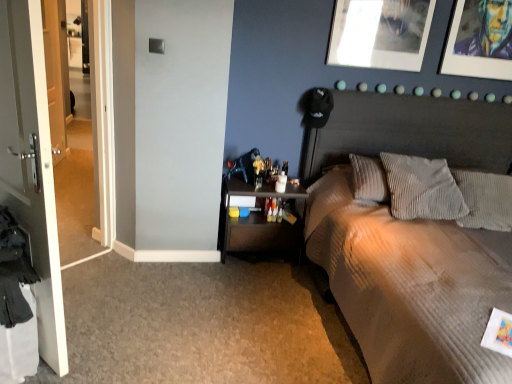
The image size is (512, 384). Describe the element at coordinates (31, 164) in the screenshot. I see `white glossy door at left` at that location.

Describe the element at coordinates (380, 33) in the screenshot. I see `metallic silver picture frame at upper center, which appears as the first picture frame when viewed from the left` at that location.

The image size is (512, 384). What are the coordinates of `white corduroy pillow at center, which is the 1th pillow from left to right` in the screenshot? It's located at (422, 188).

The width and height of the screenshot is (512, 384). Find the location of `gray corduroy pillow at right, the 1th pillow from the right`. gray corduroy pillow at right, the 1th pillow from the right is located at coordinates (485, 200).

Considering the sizes of objects dark wood nightstand at lower center and white corduroy pillow at center, the 2th pillow when ordered from right to left, in the image provided, who is smaller, dark wood nightstand at lower center or white corduroy pillow at center, the 2th pillow when ordered from right to left,?

white corduroy pillow at center, the 2th pillow when ordered from right to left.

Is dark wood nightstand at lower center facing towards white corduroy pillow at center, the 2th pillow when ordered from right to left?

No, dark wood nightstand at lower center does not turn towards white corduroy pillow at center, the 2th pillow when ordered from right to left.

In order to click on nightstand located below the white corduroy pillow at center, the 2th pillow when ordered from right to left (from the image's perspective) in this screenshot , I will do coord(258,221).

From a real-world perspective, is white corduroy pillow at center, which is the 1th pillow from left to right, positioned above or below textured beige bed at upper right?

Clearly, from a real-world perspective, white corduroy pillow at center, which is the 1th pillow from left to right, is above textured beige bed at upper right.

Consider the image. Which object is positioned more to the left, white corduroy pillow at center, the 2th pillow when ordered from right to left, or textured beige bed at upper right?

From the viewer's perspective, white corduroy pillow at center, the 2th pillow when ordered from right to left, appears more on the left side.

Considering their positions, is white corduroy pillow at center, the 2th pillow when ordered from right to left, located in front of or behind textured beige bed at upper right?

In the image, white corduroy pillow at center, the 2th pillow when ordered from right to left, appears behind textured beige bed at upper right.

Can we say textured beige bed at upper right lies outside metallic silver picture frame at upper right, which is the 1th picture frame in right-to-left order?

textured beige bed at upper right is positioned outside metallic silver picture frame at upper right, which is the 1th picture frame in right-to-left order.

Which of these two, textured beige bed at upper right or metallic silver picture frame at upper right, which is the second picture frame in left-to-right order, is bigger?

textured beige bed at upper right is bigger.

Is textured beige bed at upper right to the left of metallic silver picture frame at upper right, which is the 1th picture frame in right-to-left order, from the viewer's perspective?

Correct, you'll find textured beige bed at upper right to the left of metallic silver picture frame at upper right, which is the 1th picture frame in right-to-left order.

From a real-world perspective, is textured beige bed at upper right beneath metallic silver picture frame at upper right, which is the 1th picture frame in right-to-left order?

Yes, from a real-world perspective, textured beige bed at upper right is under metallic silver picture frame at upper right, which is the 1th picture frame in right-to-left order.

The image size is (512, 384). Find the location of `door above the gray corduroy pillow at right, acting as the second pillow starting from the left (from a real-world perspective)`. door above the gray corduroy pillow at right, acting as the second pillow starting from the left (from a real-world perspective) is located at coordinates (31, 164).

Between point (455, 179) and point (47, 235), which one is positioned behind?

The point (455, 179) is farther from the camera.

Relative to white glossy door at left, is gray corduroy pillow at right, the 1th pillow from the right, in front or behind?

gray corduroy pillow at right, the 1th pillow from the right, is positioned farther from the viewer than white glossy door at left.

Between gray corduroy pillow at right, the 1th pillow from the right, and white glossy door at left, which one appears on the left side from the viewer's perspective?

Positioned to the left is white glossy door at left.

Could you measure the distance between textured beige bed at upper right and gray corduroy pillow at right, acting as the second pillow starting from the left?

textured beige bed at upper right and gray corduroy pillow at right, acting as the second pillow starting from the left, are 19.31 inches apart.

Can gray corduroy pillow at right, acting as the second pillow starting from the left, be found inside textured beige bed at upper right?

Yes, gray corduroy pillow at right, acting as the second pillow starting from the left, is a part of textured beige bed at upper right.

Based on the photo, from a real-world perspective, is textured beige bed at upper right positioned over gray corduroy pillow at right, the 1th pillow from the right, based on gravity?

No, from a real-world perspective, textured beige bed at upper right is not above gray corduroy pillow at right, the 1th pillow from the right.

In the image, there is a gray corduroy pillow at right, acting as the second pillow starting from the left. At what (x,y) coordinates should I click in order to perform the action: click on bed below it (from the image's perspective). Please return your answer as a coordinate pair (x, y). This screenshot has width=512, height=384. Looking at the image, I should click on (411, 287).

Is metallic silver picture frame at upper center, acting as the second picture frame starting from the right, positioned behind white glossy door at left?

Yes.

Is metallic silver picture frame at upper center, acting as the second picture frame starting from the right, with white glossy door at left?

No, metallic silver picture frame at upper center, acting as the second picture frame starting from the right, is not making contact with white glossy door at left.

Is metallic silver picture frame at upper center, acting as the second picture frame starting from the right, wider than white glossy door at left?

Incorrect, the width of metallic silver picture frame at upper center, acting as the second picture frame starting from the right, does not surpass that of white glossy door at left.

Between gray corduroy pillow at right, the 1th pillow from the right, and white corduroy pillow at center, which is the 1th pillow from left to right, which one has larger width?

gray corduroy pillow at right, the 1th pillow from the right.

Is gray corduroy pillow at right, acting as the second pillow starting from the left, oriented towards white corduroy pillow at center, which is the 1th pillow from left to right?

No.

Considering the relative sizes of gray corduroy pillow at right, the 1th pillow from the right, and white corduroy pillow at center, which is the 1th pillow from left to right, in the image provided, is gray corduroy pillow at right, the 1th pillow from the right, bigger than white corduroy pillow at center, which is the 1th pillow from left to right,?

No, gray corduroy pillow at right, the 1th pillow from the right, is not bigger than white corduroy pillow at center, which is the 1th pillow from left to right.

From a real-world perspective, starting from the dark wood nightstand at lower center, which pillow is the 2nd one vertically above it? Please provide its 2D coordinates.

[(422, 188)]

Locate an element on the screen. The image size is (512, 384). bed below the white corduroy pillow at center, which is the 1th pillow from left to right (from the image's perspective) is located at coordinates (411, 287).

Based on their spatial positions, is white glossy door at left or gray corduroy pillow at right, the 1th pillow from the right, further from textured beige bed at upper right?

white glossy door at left lies further to textured beige bed at upper right than the other object.

Looking at the image, which one is located further to gray corduroy pillow at right, acting as the second pillow starting from the left, white glossy door at left or metallic silver picture frame at upper center, acting as the second picture frame starting from the right?

white glossy door at left is further to gray corduroy pillow at right, acting as the second pillow starting from the left.

Which object lies nearer to the anchor point dark wood nightstand at lower center, white corduroy pillow at center, which is the 1th pillow from left to right, or gray corduroy pillow at right, the 1th pillow from the right?

white corduroy pillow at center, which is the 1th pillow from left to right, is positioned closer to the anchor dark wood nightstand at lower center.

From the image, which object appears to be farther from dark wood nightstand at lower center, metallic silver picture frame at upper center, acting as the second picture frame starting from the right, or metallic silver picture frame at upper right, which is the second picture frame in left-to-right order?

metallic silver picture frame at upper right, which is the second picture frame in left-to-right order.

Looking at the image, which one is located further to gray corduroy pillow at right, acting as the second pillow starting from the left, white corduroy pillow at center, the 2th pillow when ordered from right to left, or textured beige bed at upper right?

Among the two, textured beige bed at upper right is located further to gray corduroy pillow at right, acting as the second pillow starting from the left.

When comparing their distances from gray corduroy pillow at right, acting as the second pillow starting from the left, does dark wood nightstand at lower center or metallic silver picture frame at upper right, which is the second picture frame in left-to-right order, seem closer?

Among the two, metallic silver picture frame at upper right, which is the second picture frame in left-to-right order, is located nearer to gray corduroy pillow at right, acting as the second pillow starting from the left.

When comparing their distances from white glossy door at left, does white corduroy pillow at center, the 2th pillow when ordered from right to left, or gray corduroy pillow at right, the 1th pillow from the right, seem further?

gray corduroy pillow at right, the 1th pillow from the right, is positioned further to the anchor white glossy door at left.

Which object lies further to the anchor point dark wood nightstand at lower center, metallic silver picture frame at upper right, which is the 1th picture frame in right-to-left order, or textured beige bed at upper right?

metallic silver picture frame at upper right, which is the 1th picture frame in right-to-left order, lies further to dark wood nightstand at lower center than the other object.

This screenshot has width=512, height=384. I want to click on nightstand between textured beige bed at upper right and metallic silver picture frame at upper right, which is the second picture frame in left-to-right order, along the z-axis, so click(258, 221).

Where is `nightstand located between textured beige bed at upper right and metallic silver picture frame at upper center, acting as the second picture frame starting from the right, in the depth direction`? nightstand located between textured beige bed at upper right and metallic silver picture frame at upper center, acting as the second picture frame starting from the right, in the depth direction is located at coordinates (258, 221).

The height and width of the screenshot is (384, 512). I want to click on pillow between dark wood nightstand at lower center and gray corduroy pillow at right, the 1th pillow from the right, from left to right, so click(422, 188).

Locate an element on the screen. nightstand between white glossy door at left and textured beige bed at upper right is located at coordinates (258, 221).